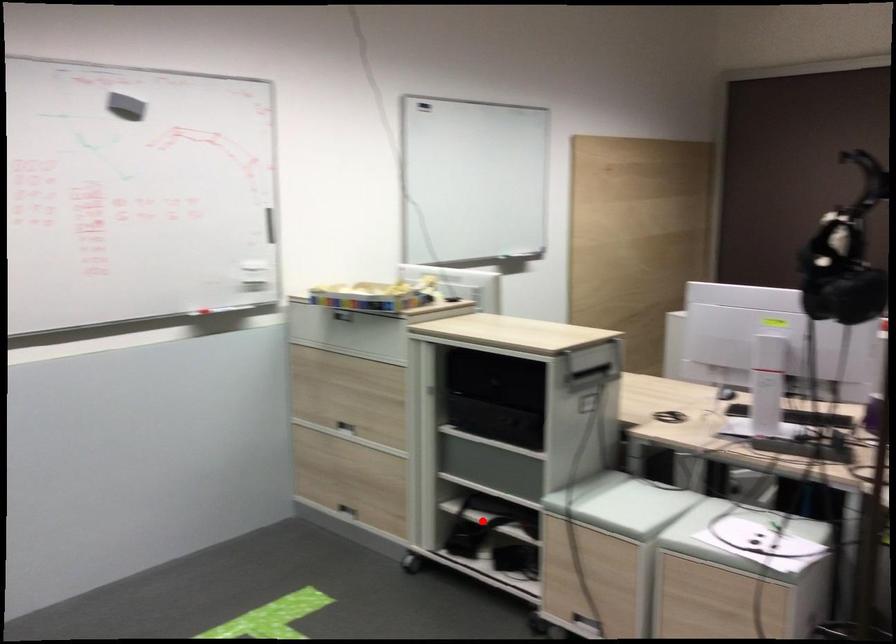
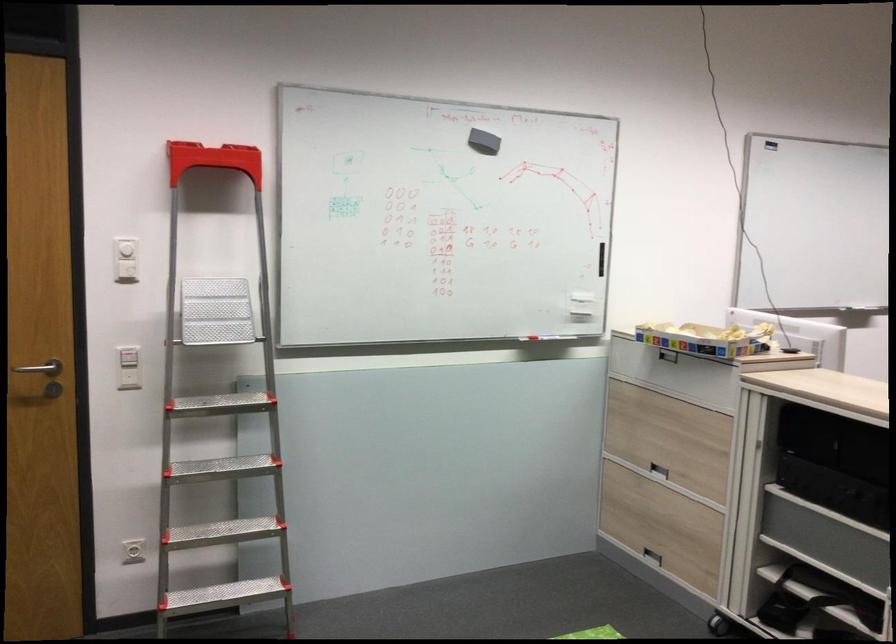
Question: I am providing you with two images of the same scene from different viewpoints. In image1, a red point is highlighted. Considering the same 3D point in image2, which of the following is correct?

Choices:
 (A) It is closer
 (B) It is farther

Answer: (A)